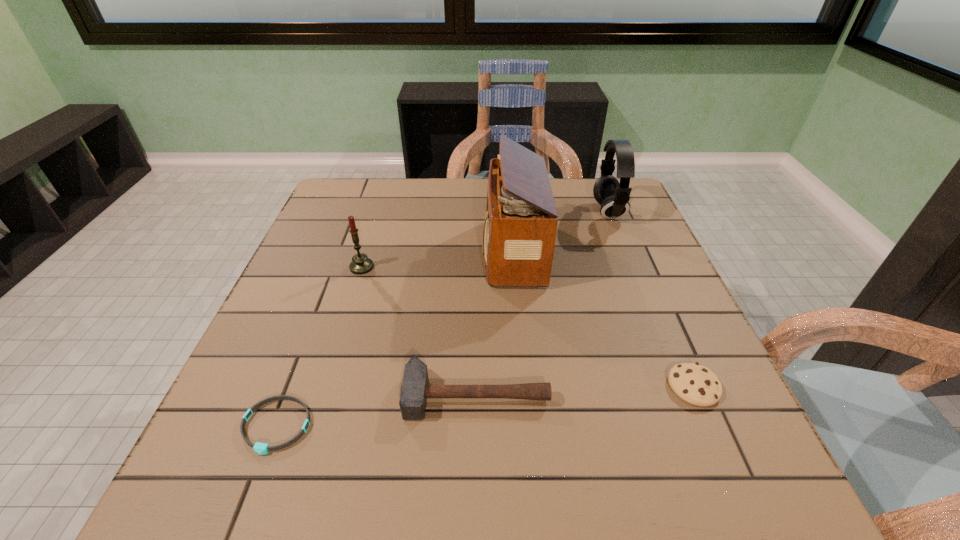
You are a GUI agent. You are given a task and a screenshot of the screen. Output one action in this format:
    pyautogui.click(x=<x>, y=<y>)
    Task: Click on the tallest object
    The width and height of the screenshot is (960, 540).
    Given the screenshot: What is the action you would take?
    pyautogui.click(x=520, y=227)

This screenshot has width=960, height=540. I want to click on earphone, so click(614, 197).

Find the location of a particular element. This screenshot has height=540, width=960. the fourth shortest object is located at coordinates (361, 264).

Where is `the third shortest object`? Image resolution: width=960 pixels, height=540 pixels. the third shortest object is located at coordinates (415, 389).

The width and height of the screenshot is (960, 540). I want to click on cookie, so click(695, 384).

This screenshot has width=960, height=540. I want to click on wristband, so click(260, 448).

Image resolution: width=960 pixels, height=540 pixels. Identify the location of free space located on the front panel of the tallest object. (412, 251).

Where is `vacant point located on the front panel of the tallest object`? The height and width of the screenshot is (540, 960). vacant point located on the front panel of the tallest object is located at coordinates (431, 251).

Where is `vacant space located 0.060m on the front panel of the tallest object`? The width and height of the screenshot is (960, 540). vacant space located 0.060m on the front panel of the tallest object is located at coordinates (459, 251).

Locate an element on the screen. Image resolution: width=960 pixels, height=540 pixels. vacant space located 0.230m on the ear cups of the earphone is located at coordinates (514, 211).